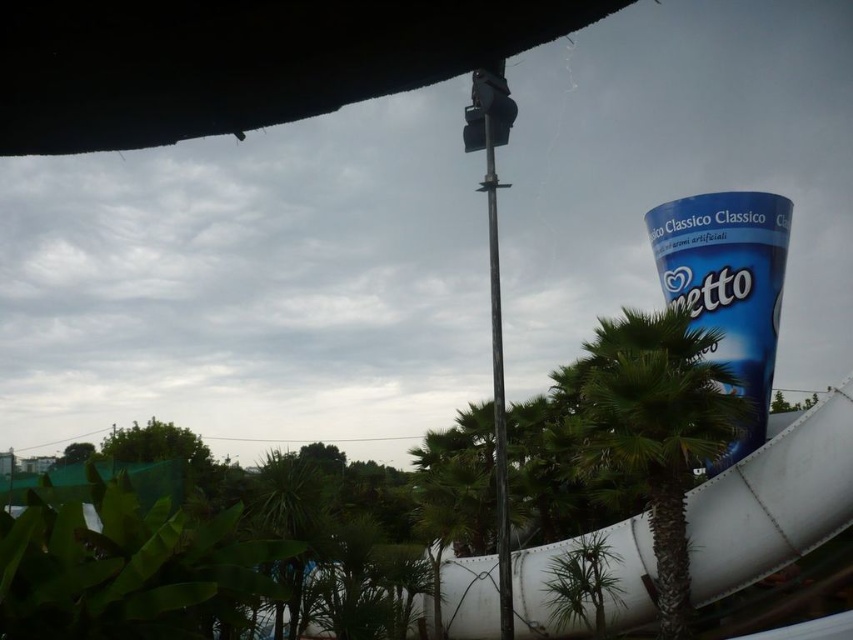
Question: Based on their relative distances, which object is farther from the green leafy palm tree at center?

Choices:
 (A) metallic pole at center
 (B) blue glossy ice cream cup at right
 (C) black matte canopy at upper center
 (D) green leafy palm tree at right

Answer: (B)

Question: Can you confirm if green leafy palm tree at right is positioned to the right of green leafy palm tree at center?

Choices:
 (A) no
 (B) yes

Answer: (B)

Question: Is black matte canopy at upper center positioned behind green leafy palm tree at right?

Choices:
 (A) yes
 (B) no

Answer: (B)

Question: Based on their relative distances, which object is farther from the metallic pole at center?

Choices:
 (A) black matte canopy at upper center
 (B) white matte slide at right
 (C) green leafy palm tree at right
 (D) blue glossy ice cream cup at right

Answer: (D)

Question: Among these objects, which one is farthest from the camera?

Choices:
 (A) white matte slide at right
 (B) blue glossy ice cream cup at right
 (C) green leafy palm tree at center

Answer: (B)

Question: Can you confirm if white matte slide at right is positioned above blue glossy ice cream cup at right?

Choices:
 (A) yes
 (B) no

Answer: (B)